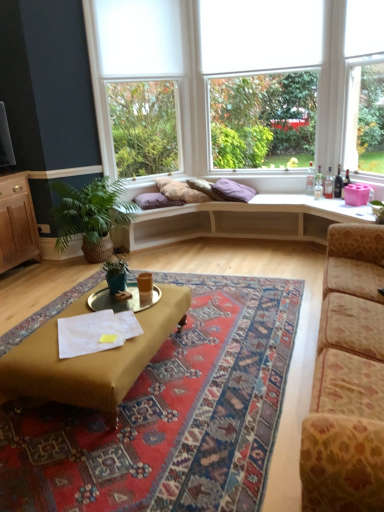
Question: Does purple cotton pillow at center, which is the 2th pillow from left to right, have a smaller size compared to leopard print fabric couch at right?

Choices:
 (A) yes
 (B) no

Answer: (A)

Question: Is purple cotton pillow at center, positioned as the 1th pillow in right-to-left order, oriented away from leopard print fabric couch at right?

Choices:
 (A) no
 (B) yes

Answer: (A)

Question: Could you tell me if purple cotton pillow at center, positioned as the 1th pillow in right-to-left order, is turned towards leopard print fabric couch at right?

Choices:
 (A) yes
 (B) no

Answer: (A)

Question: From the image's perspective, is purple cotton pillow at center, which is the 2th pillow from left to right, on leopard print fabric couch at right?

Choices:
 (A) yes
 (B) no

Answer: (A)

Question: From a real-world perspective, is purple cotton pillow at center, positioned as the 1th pillow in right-to-left order, under leopard print fabric couch at right?

Choices:
 (A) yes
 (B) no

Answer: (B)

Question: Can you confirm if purple cotton pillow at center, positioned as the 1th pillow in right-to-left order, is positioned to the right of leopard print fabric couch at right?

Choices:
 (A) yes
 (B) no

Answer: (B)

Question: Considering the relative sizes of purple cotton pillow at center, positioned as the 1th pillow in right-to-left order, and white fabric blind at upper center in the image provided, is purple cotton pillow at center, positioned as the 1th pillow in right-to-left order, taller than white fabric blind at upper center?

Choices:
 (A) no
 (B) yes

Answer: (A)

Question: Is purple cotton pillow at center, which is the 2th pillow from left to right, to the right of white fabric blind at upper center from the viewer's perspective?

Choices:
 (A) yes
 (B) no

Answer: (B)

Question: From a real-world perspective, is purple cotton pillow at center, positioned as the 1th pillow in right-to-left order, under white fabric blind at upper center?

Choices:
 (A) no
 (B) yes

Answer: (B)

Question: Is purple cotton pillow at center, which is the 2th pillow from left to right, turned away from white fabric blind at upper center?

Choices:
 (A) no
 (B) yes

Answer: (A)

Question: Can you confirm if purple cotton pillow at center, which is the 2th pillow from left to right, is positioned to the left of white fabric blind at upper center?

Choices:
 (A) yes
 (B) no

Answer: (A)

Question: Is purple cotton pillow at center, positioned as the 1th pillow in right-to-left order, bigger than white fabric blind at upper center?

Choices:
 (A) yes
 (B) no

Answer: (A)

Question: Is mustard fabric coffee table at center bigger than purple fabric pillow at center, the 1th pillow in the left-to-right sequence?

Choices:
 (A) yes
 (B) no

Answer: (A)